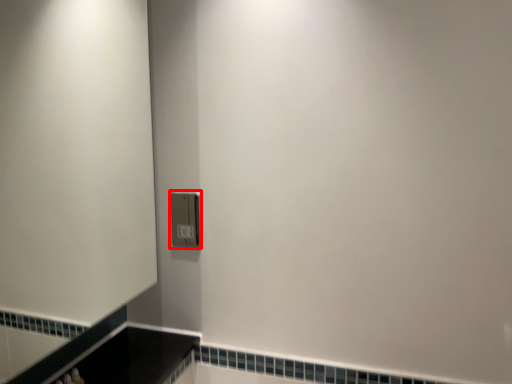
Question: From the image's perspective, what is the correct spatial positioning of light switch (annotated by the red box) in reference to screen door?

Choices:
 (A) above
 (B) below

Answer: (B)